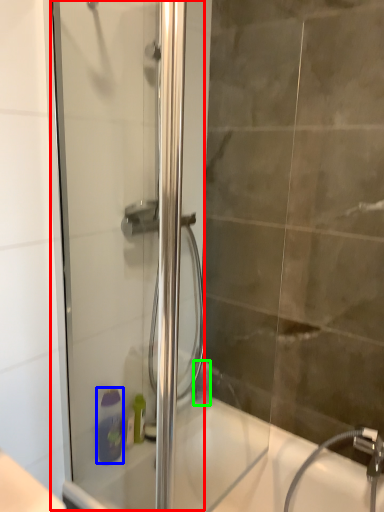
Question: Which object is positioned farthest from screen door (highlighted by a red box)? Select from soap dispenser (highlighted by a blue box) and toiletry (highlighted by a green box).

Choices:
 (A) soap dispenser
 (B) toiletry

Answer: (B)